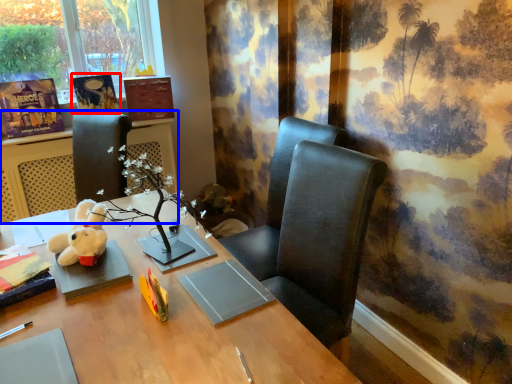
Question: Which of the following is the closest to the observer, book (highlighted by a red box) or table (highlighted by a blue box)?

Choices:
 (A) book
 (B) table

Answer: (B)